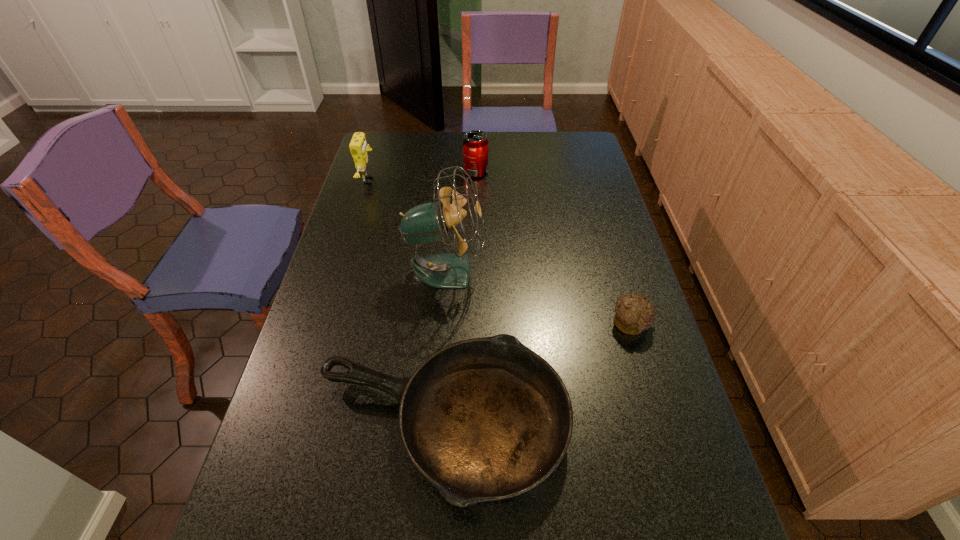
This screenshot has height=540, width=960. Find the location of `vacant space that satisfies the following two spatial constraints: 1. on the front-facing side of the nearest object for air flow; 2. on the right side of the tallest object`. vacant space that satisfies the following two spatial constraints: 1. on the front-facing side of the nearest object for air flow; 2. on the right side of the tallest object is located at coordinates tap(435, 423).

Find the location of a particular element. This screenshot has width=960, height=540. blank space that satisfies the following two spatial constraints: 1. on the back side of the rightmost object; 2. on the face of the leftmost object is located at coordinates (588, 180).

The image size is (960, 540). Identify the location of blank area in the image that satisfies the following two spatial constraints: 1. on the front side of the soda can; 2. on the right side of the muffin. tap(474, 324).

At what (x,y) coordinates should I click in order to perform the action: click on free spot that satisfies the following two spatial constraints: 1. on the face of the nearest object; 2. on the left side of the leftmost object. Please return your answer as a coordinate pair (x, y). Looking at the image, I should click on (294, 423).